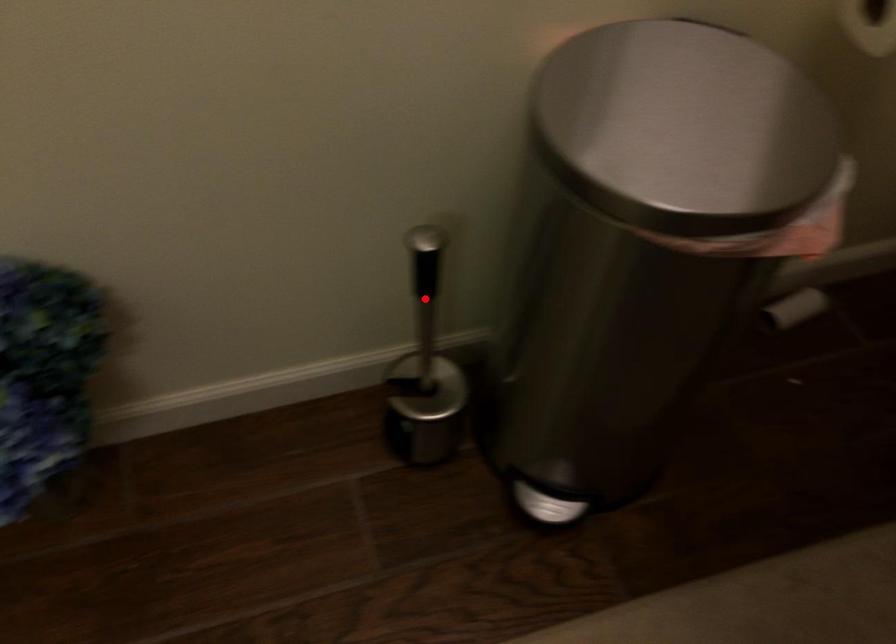
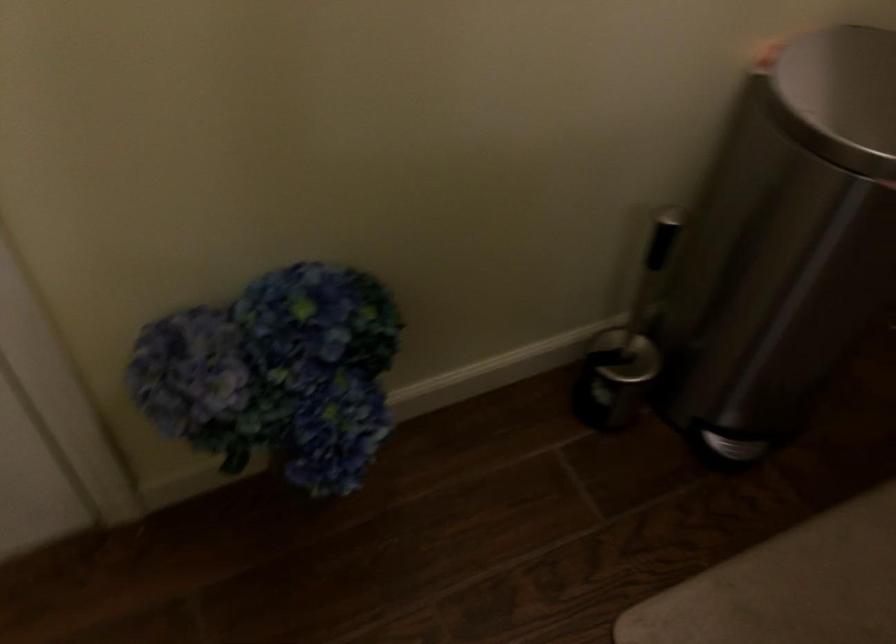
Question: I am providing you with two images of the same scene from different viewpoints. A red point is shown in image1. For the corresponding object point in image2, is it positioned nearer or farther from the camera?

Choices:
 (A) Nearer
 (B) Farther

Answer: (B)